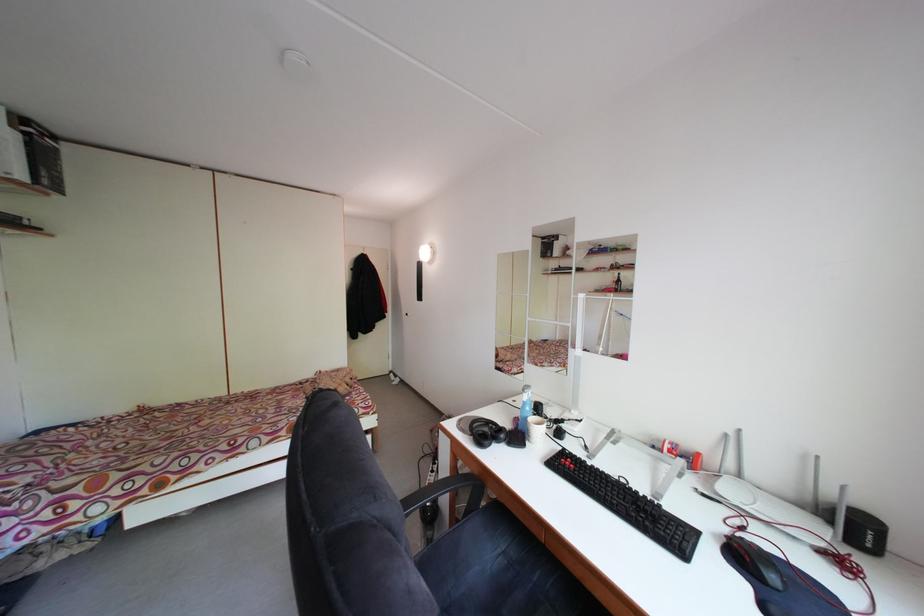
In order to click on black chair armrest in this screenshot , I will do `click(431, 493)`.